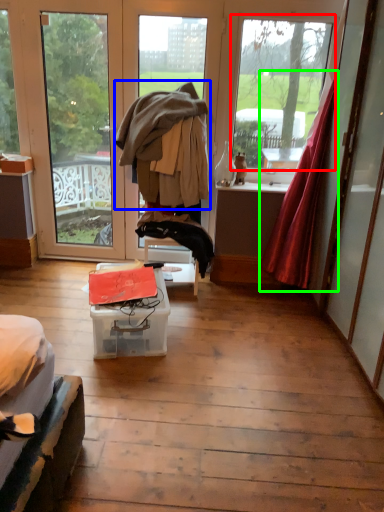
Question: Which object is positioned closest to window (highlighted by a red box)? Select from jacket (highlighted by a blue box) and curtain (highlighted by a green box).

Choices:
 (A) jacket
 (B) curtain

Answer: (B)